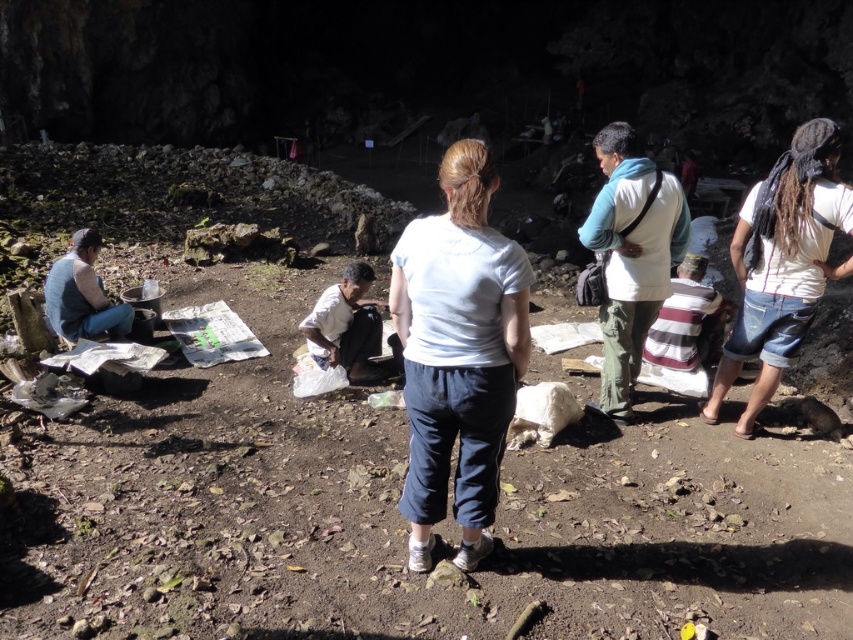
You are part of a hiking group and need to locate your belongings. You see the white cotton shirt at right and the white fabric bag at center. Which item is closer to the cave entrance?

The white fabric bag at center is closer to the cave entrance because the white cotton shirt at right is to the right of it, meaning the bag is between the shirt and the entrance.

You are standing at the point marked as point (457, 353) in the image. What is the nearest object to you?

The point (457, 353) corresponds to the white cotton shirt at center, so the nearest object to you is the white cotton shirt at center.